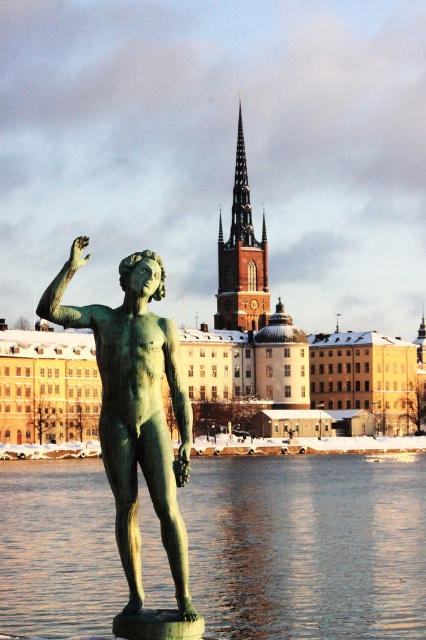
Does point (32, 490) lie behind point (258, 250)?

That is False.

At what (x,y) coordinates should I click in order to perform the action: click on green reflective water at statue front. Please return your answer as a coordinate pair (x, y). Looking at the image, I should click on (307, 547).

Is green patina statue at center positioned before brown stone spire at center?

Yes, it is in front of brown stone spire at center.

Does green patina statue at center have a greater height compared to brown stone spire at center?

Incorrect, green patina statue at center's height is not larger of brown stone spire at center's.

I want to click on green patina statue at center, so click(135, 410).

Can you confirm if green reflective water at statue front is positioned above green patina statue at center?

Incorrect, green reflective water at statue front is not positioned above green patina statue at center.

Is green reflective water at statue front smaller than green patina statue at center?

Yes.

Between point (356, 483) and point (152, 394), which one is positioned behind?

The point (356, 483) is more distant.

Where is `green reflective water at statue front`? The height and width of the screenshot is (640, 426). green reflective water at statue front is located at coordinates (307, 547).